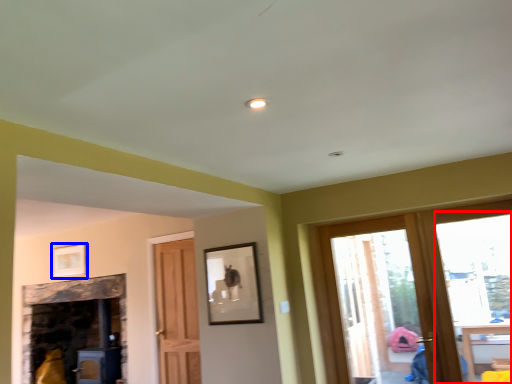
Question: Which point is closer to the camera, window (highlighted by a red box) or picture frame (highlighted by a blue box)?

Choices:
 (A) window
 (B) picture frame

Answer: (A)